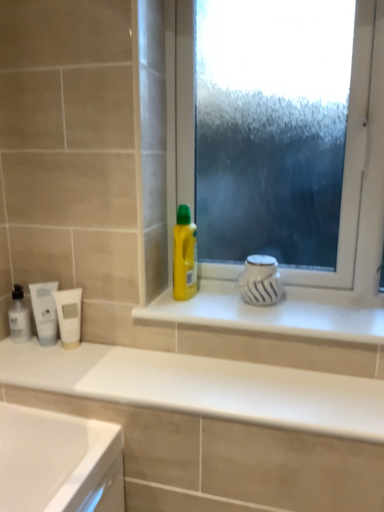
Find the location of a particular element. The width and height of the screenshot is (384, 512). free spot to the right of white matte tube at left, the second mouthwash viewed from the left is located at coordinates (101, 356).